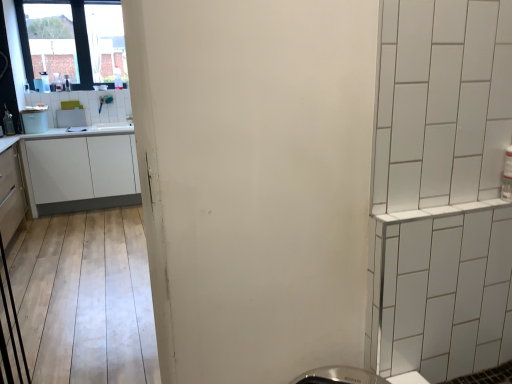
Question: Considering the relative positions of transparent glass window at upper left and white glossy microwave at upper left, which ranks as the 2th appliance in front-to-back order, in the image provided, is transparent glass window at upper left to the right of white glossy microwave at upper left, which ranks as the 2th appliance in front-to-back order, from the viewer's perspective?

Choices:
 (A) yes
 (B) no

Answer: (B)

Question: Is white glossy microwave at upper left, which is counted as the 1th appliance, starting from the back, surrounded by transparent glass window at upper left?

Choices:
 (A) yes
 (B) no

Answer: (B)

Question: Considering the relative sizes of transparent glass window at upper left and white glossy microwave at upper left, which ranks as the 2th appliance in front-to-back order, in the image provided, is transparent glass window at upper left smaller than white glossy microwave at upper left, which ranks as the 2th appliance in front-to-back order,?

Choices:
 (A) yes
 (B) no

Answer: (B)

Question: Can you confirm if transparent glass window at upper left is shorter than white glossy microwave at upper left, which ranks as the 2th appliance in front-to-back order?

Choices:
 (A) yes
 (B) no

Answer: (B)

Question: Can you see transparent glass window at upper left touching white glossy microwave at upper left, which is counted as the 1th appliance, starting from the back?

Choices:
 (A) no
 (B) yes

Answer: (A)

Question: Is point (80, 114) positioned closer to the camera than point (27, 208)?

Choices:
 (A) closer
 (B) farther

Answer: (B)

Question: Is white glossy microwave at upper left, which is counted as the 1th appliance, starting from the back, taller or shorter than matte white cabinet at left, the 1th cabinetry viewed from the front?

Choices:
 (A) tall
 (B) short

Answer: (B)

Question: In the image, is white glossy microwave at upper left, which is counted as the 1th appliance, starting from the back, positioned in front of or behind matte white cabinet at left, the 1th cabinetry viewed from the front?

Choices:
 (A) behind
 (B) front

Answer: (A)

Question: Is white glossy microwave at upper left, which is counted as the 1th appliance, starting from the back, bigger or smaller than matte white cabinet at left, the 1th cabinetry viewed from the front?

Choices:
 (A) big
 (B) small

Answer: (B)

Question: From a real-world perspective, is white matte cabinet at left, the second cabinetry viewed from the front, physically located above or below matte white cabinet at left, which is counted as the 2th cabinetry, starting from the back?

Choices:
 (A) above
 (B) below

Answer: (B)

Question: Is white matte cabinet at left, positioned as the 1th cabinetry in back-to-front order, in front of or behind matte white cabinet at left, which is counted as the 2th cabinetry, starting from the back, in the image?

Choices:
 (A) behind
 (B) front

Answer: (A)

Question: Considering the positions of white matte cabinet at left, positioned as the 1th cabinetry in back-to-front order, and matte white cabinet at left, the 1th cabinetry viewed from the front, in the image, is white matte cabinet at left, positioned as the 1th cabinetry in back-to-front order, taller or shorter than matte white cabinet at left, the 1th cabinetry viewed from the front,?

Choices:
 (A) short
 (B) tall

Answer: (A)

Question: Looking at the image, does white matte cabinet at left, the second cabinetry viewed from the front, seem bigger or smaller compared to matte white cabinet at left, the 1th cabinetry viewed from the front?

Choices:
 (A) big
 (B) small

Answer: (A)

Question: In the image, is white glossy microwave at upper left, which ranks as the 2th appliance in front-to-back order, positioned in front of or behind white matte cabinet at left, positioned as the 1th cabinetry in back-to-front order?

Choices:
 (A) front
 (B) behind

Answer: (B)

Question: From the image's perspective, relative to white matte cabinet at left, the second cabinetry viewed from the front, is white glossy microwave at upper left, which is counted as the 1th appliance, starting from the back, above or below?

Choices:
 (A) below
 (B) above

Answer: (B)